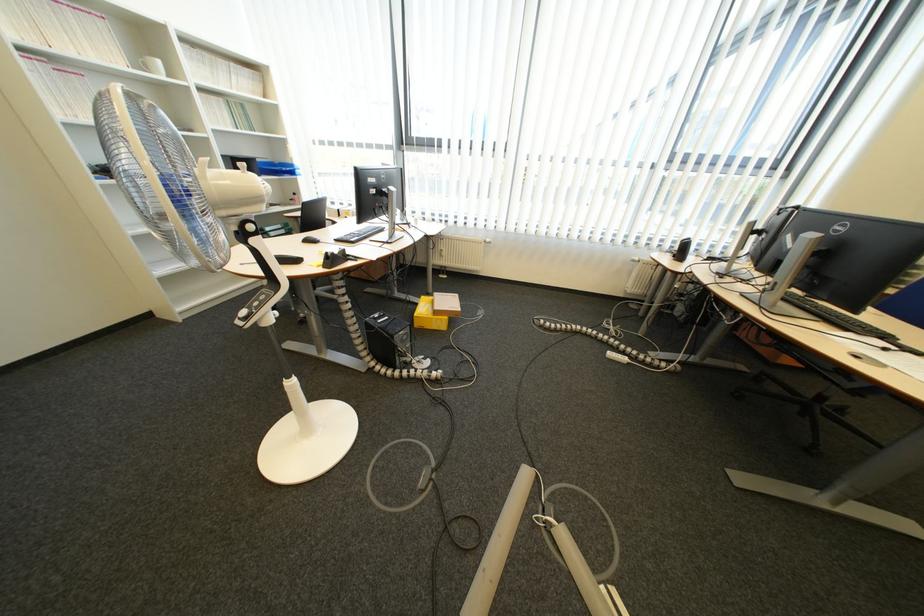
You are a GUI agent. You are given a task and a screenshot of the screen. Output one action in this format:
    pyautogui.click(x=<x>, y=<y>)
    Task: Click on the blue plastic tray
    The width and height of the screenshot is (924, 616).
    Given the screenshot: What is the action you would take?
    pyautogui.click(x=276, y=168)